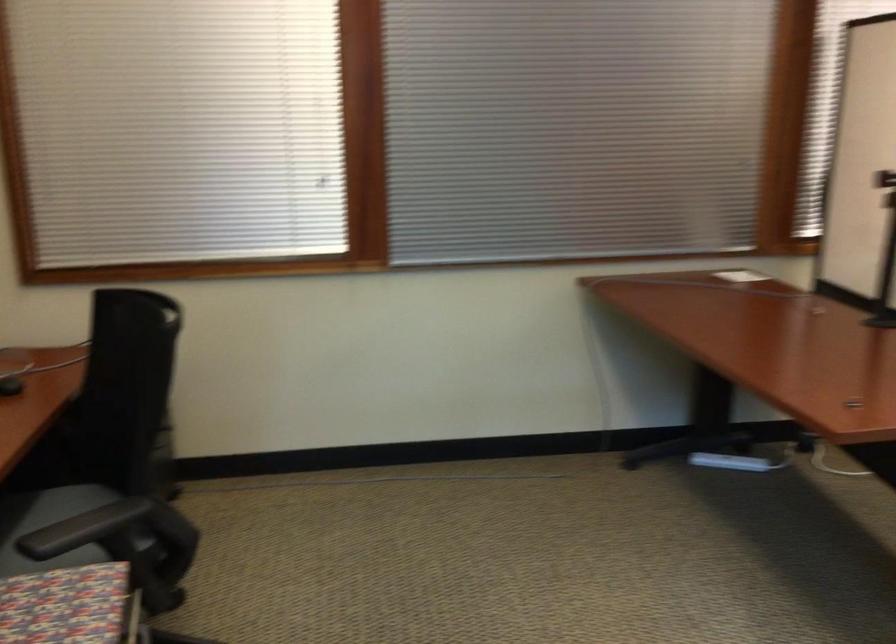
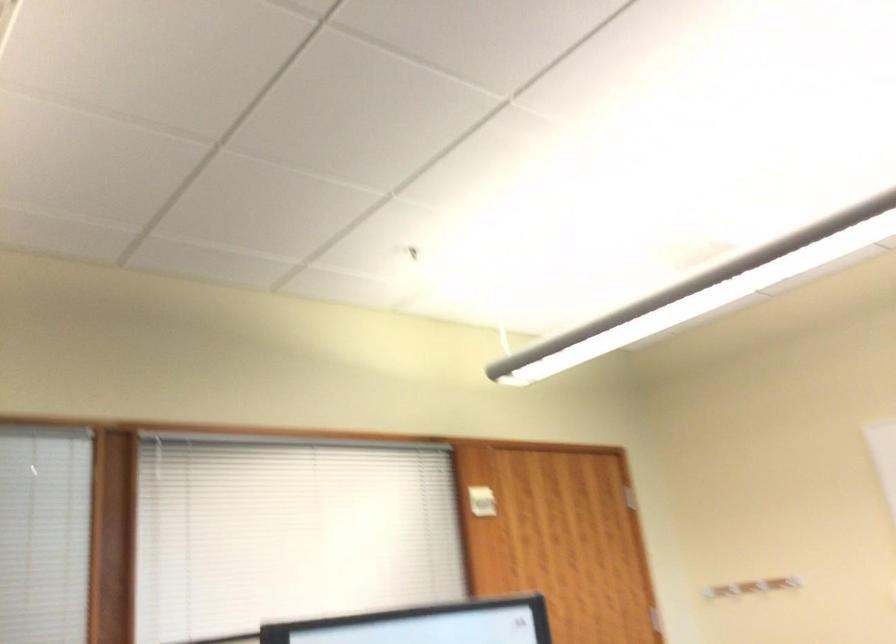
The images are taken continuously from a first-person perspective. In which direction is your viewpoint rotating?

The camera rotated toward right-up.